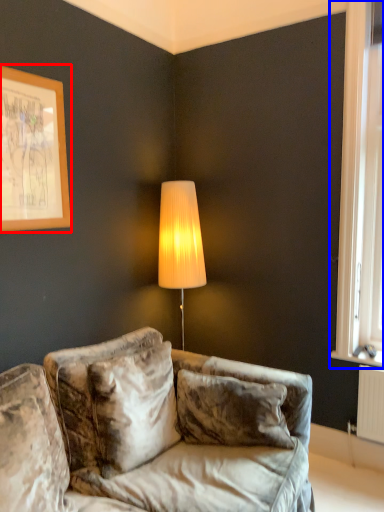
Question: Among these objects, which one is nearest to the camera, picture frame (highlighted by a red box) or window (highlighted by a blue box)?

Choices:
 (A) picture frame
 (B) window

Answer: (A)